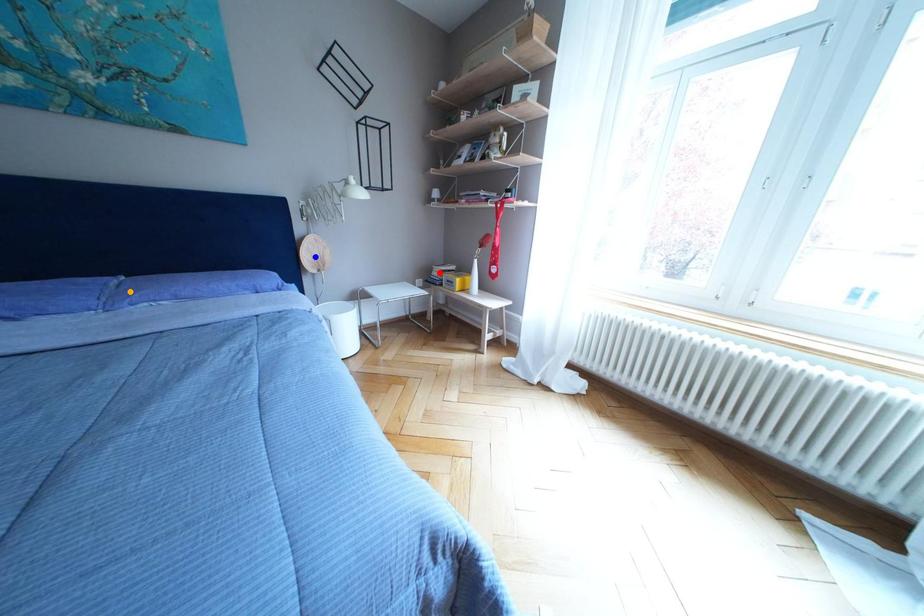
Order these from nearest to farthest:
blue point | orange point | red point

orange point < blue point < red point